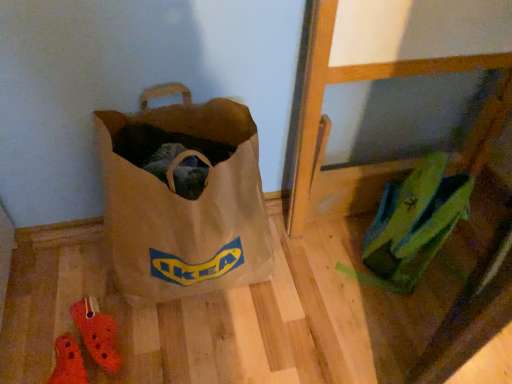
Where is `rubber crocs at lower left, which is counted as the 1th footwear, starting from the bottom`? This screenshot has height=384, width=512. rubber crocs at lower left, which is counted as the 1th footwear, starting from the bottom is located at coordinates (68, 362).

What do you see at coordinates (97, 333) in the screenshot? I see `orange croc at lower left, the 1th footwear viewed from the top` at bounding box center [97, 333].

This screenshot has height=384, width=512. I want to click on rubber crocs at lower left, which is counted as the 1th footwear, starting from the bottom, so click(68, 362).

Is orange croc at lower left, the second footwear positioned from the bottom, turned away from green fabric backpack at upper right?

No, orange croc at lower left, the second footwear positioned from the bottom,'s orientation is not away from green fabric backpack at upper right.

In the image, there is a orange croc at lower left, the second footwear positioned from the bottom. Find the location of `grocery bag above it (from the image's perspective)`. grocery bag above it (from the image's perspective) is located at coordinates (415, 221).

Based on the photo, from the image's perspective, which one is positioned higher, orange croc at lower left, the 1th footwear viewed from the top, or green fabric backpack at upper right?

green fabric backpack at upper right is shown above in the image.

Would you consider rubber crocs at lower left, which ranks as the second footwear in top-to-bottom order, to be distant from green fabric backpack at upper right?

rubber crocs at lower left, which ranks as the second footwear in top-to-bottom order, is near green fabric backpack at upper right, not far away.

Considering the sizes of rubber crocs at lower left, which is counted as the 1th footwear, starting from the bottom, and green fabric backpack at upper right in the image, is rubber crocs at lower left, which is counted as the 1th footwear, starting from the bottom, taller or shorter than green fabric backpack at upper right?

rubber crocs at lower left, which is counted as the 1th footwear, starting from the bottom, is shorter than green fabric backpack at upper right.

Choose the correct answer: Is rubber crocs at lower left, which is counted as the 1th footwear, starting from the bottom, inside green fabric backpack at upper right or outside it?

rubber crocs at lower left, which is counted as the 1th footwear, starting from the bottom, is not inside green fabric backpack at upper right, it's outside.

From a real-world perspective, which is physically below, rubber crocs at lower left, which ranks as the second footwear in top-to-bottom order, or green fabric backpack at upper right?

→ rubber crocs at lower left, which ranks as the second footwear in top-to-bottom order, is physically lower.

Is rubber crocs at lower left, which ranks as the second footwear in top-to-bottom order, taller than brown canvas bag at lower left?

In fact, rubber crocs at lower left, which ranks as the second footwear in top-to-bottom order, may be shorter than brown canvas bag at lower left.

In the scene shown: Is rubber crocs at lower left, which is counted as the 1th footwear, starting from the bottom, located outside brown canvas bag at lower left?

rubber crocs at lower left, which is counted as the 1th footwear, starting from the bottom, is positioned outside brown canvas bag at lower left.

From the image's perspective, is rubber crocs at lower left, which ranks as the second footwear in top-to-bottom order, above brown canvas bag at lower left?

No, from the image's perspective, rubber crocs at lower left, which ranks as the second footwear in top-to-bottom order, is not above brown canvas bag at lower left.

Could you tell me if rubber crocs at lower left, which ranks as the second footwear in top-to-bottom order, is facing brown canvas bag at lower left?

No, rubber crocs at lower left, which ranks as the second footwear in top-to-bottom order, is not oriented towards brown canvas bag at lower left.

Considering the sizes of objects orange croc at lower left, the 1th footwear viewed from the top, and brown canvas bag at lower left in the image provided, who is taller, orange croc at lower left, the 1th footwear viewed from the top, or brown canvas bag at lower left?

brown canvas bag at lower left is taller.

At what (x,y) coordinates should I click in order to perform the action: click on luggage and bags that appears on the right of orange croc at lower left, the second footwear positioned from the bottom. Please return your answer as a coordinate pair (x, y). The height and width of the screenshot is (384, 512). Looking at the image, I should click on (185, 206).

From a real-world perspective, which object rests below the other?

orange croc at lower left, the 1th footwear viewed from the top, from a real-world perspective.

Would you consider orange croc at lower left, the second footwear positioned from the bottom, to be distant from brown canvas bag at lower left?

They are positioned close to each other.

In the scene shown: Could you tell me if rubber crocs at lower left, which ranks as the second footwear in top-to-bottom order, is turned towards orange croc at lower left, the 1th footwear viewed from the top?

No, rubber crocs at lower left, which ranks as the second footwear in top-to-bottom order, is not turned towards orange croc at lower left, the 1th footwear viewed from the top.

From the image's perspective, is rubber crocs at lower left, which ranks as the second footwear in top-to-bottom order, above orange croc at lower left, the second footwear positioned from the bottom?

No, from the image's perspective, rubber crocs at lower left, which ranks as the second footwear in top-to-bottom order, is not above orange croc at lower left, the second footwear positioned from the bottom.

From a real-world perspective, does rubber crocs at lower left, which ranks as the second footwear in top-to-bottom order, stand above orange croc at lower left, the second footwear positioned from the bottom?

No, from a real-world perspective, rubber crocs at lower left, which ranks as the second footwear in top-to-bottom order, is not above orange croc at lower left, the second footwear positioned from the bottom.

Is brown canvas bag at lower left closer to the viewer compared to rubber crocs at lower left, which ranks as the second footwear in top-to-bottom order?

Yes, brown canvas bag at lower left is closer to the camera.

How many degrees apart are the facing directions of brown canvas bag at lower left and rubber crocs at lower left, which ranks as the second footwear in top-to-bottom order?

20.6 degrees separate the facing orientations of brown canvas bag at lower left and rubber crocs at lower left, which ranks as the second footwear in top-to-bottom order.

Is brown canvas bag at lower left turned away from rubber crocs at lower left, which ranks as the second footwear in top-to-bottom order?

No, brown canvas bag at lower left is not facing away from rubber crocs at lower left, which ranks as the second footwear in top-to-bottom order.

From a real-world perspective, relative to rubber crocs at lower left, which is counted as the 1th footwear, starting from the bottom, is brown canvas bag at lower left vertically above or below?

brown canvas bag at lower left is above rubber crocs at lower left, which is counted as the 1th footwear, starting from the bottom.

How much distance is there between brown canvas bag at lower left and orange croc at lower left, the second footwear positioned from the bottom?

brown canvas bag at lower left is 32.89 centimeters away from orange croc at lower left, the second footwear positioned from the bottom.

Would you consider brown canvas bag at lower left to be distant from orange croc at lower left, the second footwear positioned from the bottom?

brown canvas bag at lower left is actually quite close to orange croc at lower left, the second footwear positioned from the bottom.

Which is behind, point (196, 241) or point (75, 319)?

The point (75, 319) is farther from the camera.

Where is `luggage and bags positioned vertically above the orange croc at lower left, the second footwear positioned from the bottom (from a real-world perspective)`? luggage and bags positioned vertically above the orange croc at lower left, the second footwear positioned from the bottom (from a real-world perspective) is located at coordinates (185, 206).

What are the coordinates of `grocery bag lying on the right of orange croc at lower left, the second footwear positioned from the bottom` in the screenshot? It's located at [415, 221].

Locate an element on the screen. This screenshot has width=512, height=384. the 2nd footwear positioned below the green fabric backpack at upper right (from the image's perspective) is located at coordinates (68, 362).

When comparing their distances from rubber crocs at lower left, which ranks as the second footwear in top-to-bottom order, does green fabric backpack at upper right or orange croc at lower left, the second footwear positioned from the bottom, seem closer?

orange croc at lower left, the second footwear positioned from the bottom, is positioned closer to the anchor rubber crocs at lower left, which ranks as the second footwear in top-to-bottom order.

Looking at the image, which one is located closer to rubber crocs at lower left, which ranks as the second footwear in top-to-bottom order, orange croc at lower left, the second footwear positioned from the bottom, or brown canvas bag at lower left?

orange croc at lower left, the second footwear positioned from the bottom, is positioned closer to the anchor rubber crocs at lower left, which ranks as the second footwear in top-to-bottom order.

Considering their positions, is orange croc at lower left, the 1th footwear viewed from the top, positioned further to brown canvas bag at lower left than rubber crocs at lower left, which is counted as the 1th footwear, starting from the bottom?

rubber crocs at lower left, which is counted as the 1th footwear, starting from the bottom, is further to brown canvas bag at lower left.

From the image, which object appears to be farther from rubber crocs at lower left, which is counted as the 1th footwear, starting from the bottom, green fabric backpack at upper right or brown canvas bag at lower left?

green fabric backpack at upper right.

When comparing their distances from brown canvas bag at lower left, does orange croc at lower left, the 1th footwear viewed from the top, or green fabric backpack at upper right seem closer?

The object closer to brown canvas bag at lower left is orange croc at lower left, the 1th footwear viewed from the top.

Considering their positions, is green fabric backpack at upper right positioned further to orange croc at lower left, the second footwear positioned from the bottom, than rubber crocs at lower left, which ranks as the second footwear in top-to-bottom order?

green fabric backpack at upper right is further to orange croc at lower left, the second footwear positioned from the bottom.

When comparing their distances from green fabric backpack at upper right, does orange croc at lower left, the 1th footwear viewed from the top, or rubber crocs at lower left, which ranks as the second footwear in top-to-bottom order, seem further?

rubber crocs at lower left, which ranks as the second footwear in top-to-bottom order, is further to green fabric backpack at upper right.

When comparing their distances from brown canvas bag at lower left, does rubber crocs at lower left, which is counted as the 1th footwear, starting from the bottom, or green fabric backpack at upper right seem closer?

Based on the image, rubber crocs at lower left, which is counted as the 1th footwear, starting from the bottom, appears to be nearer to brown canvas bag at lower left.

You are a GUI agent. You are given a task and a screenshot of the screen. Output one action in this format:
    pyautogui.click(x=<x>, y=<y>)
    Task: Click on the footwear between brown canvas bag at lower left and rubber crocs at lower left, which ranks as the second footwear in top-to-bottom order, in the vertical direction
    The width and height of the screenshot is (512, 384).
    Given the screenshot: What is the action you would take?
    pyautogui.click(x=97, y=333)

Identify the location of luggage and bags situated between orange croc at lower left, the second footwear positioned from the bottom, and green fabric backpack at upper right from left to right. (185, 206).

I want to click on footwear situated between rubber crocs at lower left, which ranks as the second footwear in top-to-bottom order, and green fabric backpack at upper right from left to right, so click(97, 333).

I want to click on luggage and bags situated between rubber crocs at lower left, which ranks as the second footwear in top-to-bottom order, and green fabric backpack at upper right from left to right, so click(x=185, y=206).